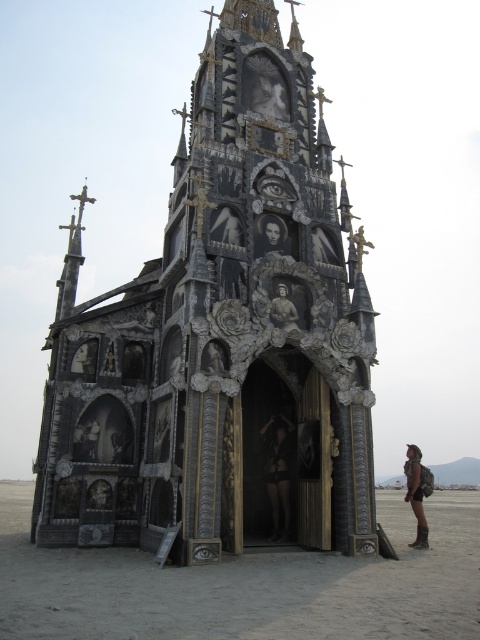
How much distance is there between black leather pants at center and smooth black portrait at center?

23.39 meters

Is black leather pants at center wider than smooth black portrait at center?

Incorrect, black leather pants at center's width does not surpass smooth black portrait at center's.

Between point (285, 477) and point (272, 230), which one is positioned behind?

The point (272, 230) is more distant.

Locate an element on the screen. This screenshot has height=640, width=480. black leather pants at center is located at coordinates (277, 472).

Which is more to the right, camouflage fabric backpack at lower right or smooth black portrait at center?

camouflage fabric backpack at lower right

Who is more forward, (420, 461) or (275, 248)?

Positioned in front is point (275, 248).

Who is more distant from viewer, (416, 502) or (276, 252)?

Positioned behind is point (416, 502).

Find the location of a particular element. The width and height of the screenshot is (480, 640). camouflage fabric backpack at lower right is located at coordinates (416, 493).

Can you confirm if black wood church at center is wider than smooth black portrait at center?

Yes, black wood church at center is wider than smooth black portrait at center.

Can you confirm if black wood church at center is shorter than smooth black portrait at center?

In fact, black wood church at center may be taller than smooth black portrait at center.

At what (x,y) coordinates should I click in order to perform the action: click on black wood church at center. Please return your answer as a coordinate pair (x, y). The width and height of the screenshot is (480, 640). Looking at the image, I should click on (220, 337).